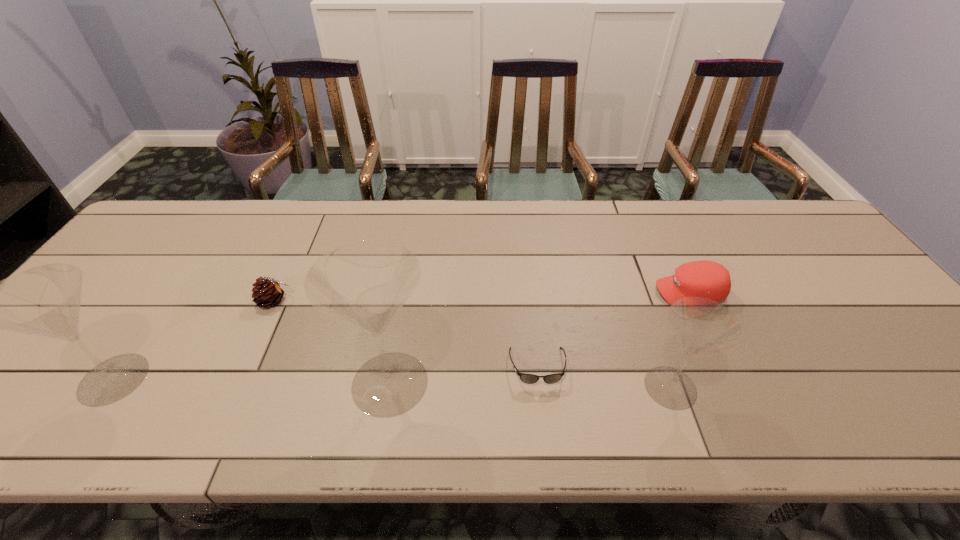
Locate an element on the screen. free space between the tallest flute glass and the rightmost flute glass is located at coordinates (530, 385).

At what (x,y) coordinates should I click in order to perform the action: click on vacant region between the sunglasses and the cap. Please return your answer as a coordinate pair (x, y). Looking at the image, I should click on (613, 329).

Image resolution: width=960 pixels, height=540 pixels. I want to click on free space between the cap and the second object from left to right, so click(482, 296).

The image size is (960, 540). I want to click on empty space between the third object from right to left and the leftmost flute glass, so click(325, 373).

Locate an element on the screen. empty location between the second flute glass from left to right and the cap is located at coordinates (540, 338).

You are a GUI agent. You are given a task and a screenshot of the screen. Output one action in this format:
    pyautogui.click(x=<x>, y=<y>)
    Task: Click on the blank region between the tallest flute glass and the fifth object from right to left
    The width and height of the screenshot is (960, 540).
    Given the screenshot: What is the action you would take?
    pyautogui.click(x=332, y=342)

Point out which object is positioned as the second nearest to the shortest object. Please provide its 2D coordinates. Your answer should be formatted as a tuple, i.e. [(x, y)], where the tuple contains the x and y coordinates of a point satisfying the conditions above.

[(365, 283)]

Where is `object that stands as the fifth closest to the cap`? object that stands as the fifth closest to the cap is located at coordinates (45, 300).

I want to click on flute glass that is the closest one to the shortest flute glass, so [x=365, y=283].

This screenshot has width=960, height=540. I want to click on flute glass identified as the closest to the rightmost flute glass, so click(365, 283).